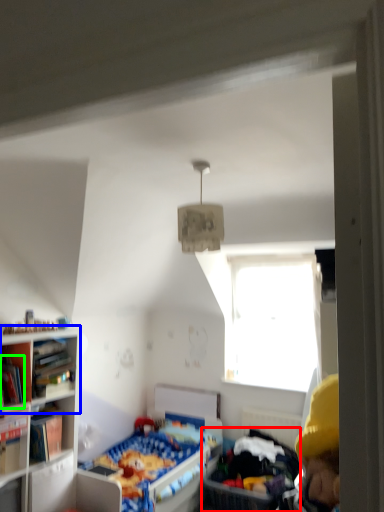
Question: Considering the real-world distances, which object is closest to infant bed (highlighted by a red box)? shelf (highlighted by a blue box) or book (highlighted by a green box).

Choices:
 (A) shelf
 (B) book

Answer: (A)